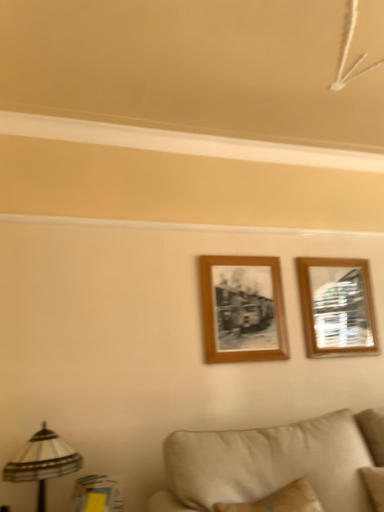
Question: Is wooden photo frame at center, which is the second picture frame in right-to-left order, facing away from beige fabric couch at lower center?

Choices:
 (A) no
 (B) yes

Answer: (A)

Question: Can you confirm if wooden photo frame at center, which is the second picture frame in right-to-left order, is bigger than beige fabric couch at lower center?

Choices:
 (A) no
 (B) yes

Answer: (A)

Question: Is wooden photo frame at center, placed as the 1th picture frame when sorted from left to right, touching beige fabric couch at lower center?

Choices:
 (A) yes
 (B) no

Answer: (B)

Question: Considering the relative positions of wooden photo frame at center, placed as the 1th picture frame when sorted from left to right, and beige fabric couch at lower center in the image provided, is wooden photo frame at center, placed as the 1th picture frame when sorted from left to right, in front of beige fabric couch at lower center?

Choices:
 (A) yes
 (B) no

Answer: (B)

Question: Considering the relative sizes of wooden photo frame at center, which is the second picture frame in right-to-left order, and beige fabric couch at lower center in the image provided, is wooden photo frame at center, which is the second picture frame in right-to-left order, shorter than beige fabric couch at lower center?

Choices:
 (A) no
 (B) yes

Answer: (A)

Question: Relative to beige fabric couch at lower center, is striped fabric lampshade at lower left in front or behind?

Choices:
 (A) behind
 (B) front

Answer: (A)

Question: From a real-world perspective, is striped fabric lampshade at lower left positioned above or below beige fabric couch at lower center?

Choices:
 (A) below
 (B) above

Answer: (B)

Question: Considering the relative positions of striped fabric lampshade at lower left and beige fabric couch at lower center in the image provided, is striped fabric lampshade at lower left to the left or to the right of beige fabric couch at lower center?

Choices:
 (A) right
 (B) left

Answer: (B)

Question: Choose the correct answer: Is striped fabric lampshade at lower left inside beige fabric couch at lower center or outside it?

Choices:
 (A) inside
 (B) outside

Answer: (B)

Question: Relative to beige fabric couch at lower center, is wooden photo frame at center, placed as the 1th picture frame when sorted from left to right, in front or behind?

Choices:
 (A) front
 (B) behind

Answer: (B)

Question: Is point (236, 259) closer or farther from the camera than point (302, 421)?

Choices:
 (A) farther
 (B) closer

Answer: (A)

Question: Considering the positions of wooden photo frame at center, placed as the 1th picture frame when sorted from left to right, and beige fabric couch at lower center in the image, is wooden photo frame at center, placed as the 1th picture frame when sorted from left to right, wider or thinner than beige fabric couch at lower center?

Choices:
 (A) thin
 (B) wide

Answer: (A)

Question: From the image's perspective, is wooden photo frame at center, placed as the 1th picture frame when sorted from left to right, above or below beige fabric couch at lower center?

Choices:
 (A) above
 (B) below

Answer: (A)

Question: Considering their positions, is striped fabric lampshade at lower left located in front of or behind wooden photo frame at center, which is the second picture frame in right-to-left order?

Choices:
 (A) behind
 (B) front

Answer: (B)

Question: Do you think striped fabric lampshade at lower left is within wooden photo frame at center, which is the second picture frame in right-to-left order, or outside of it?

Choices:
 (A) outside
 (B) inside

Answer: (A)